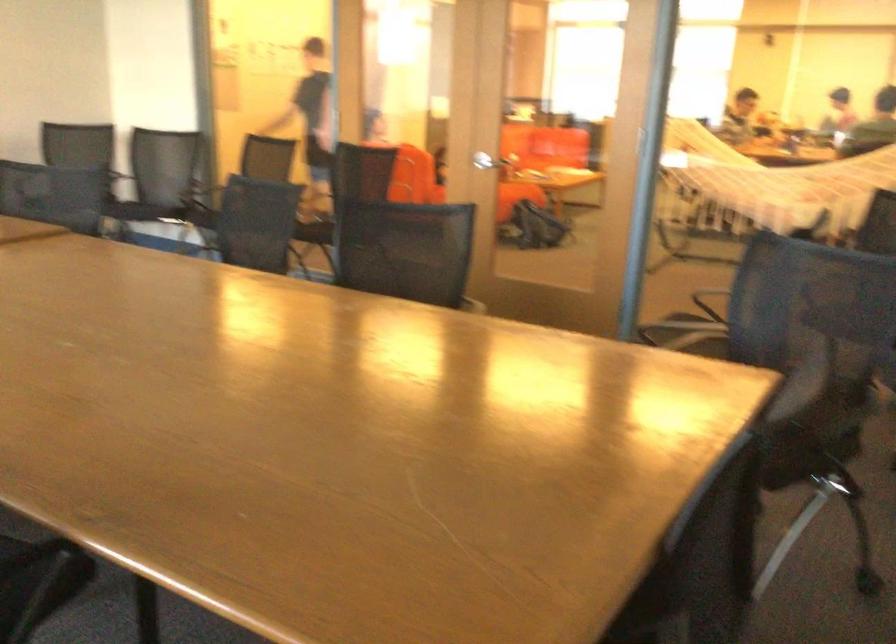
Which object does [778,182] point to?

It corresponds to the white net hammock in the image.